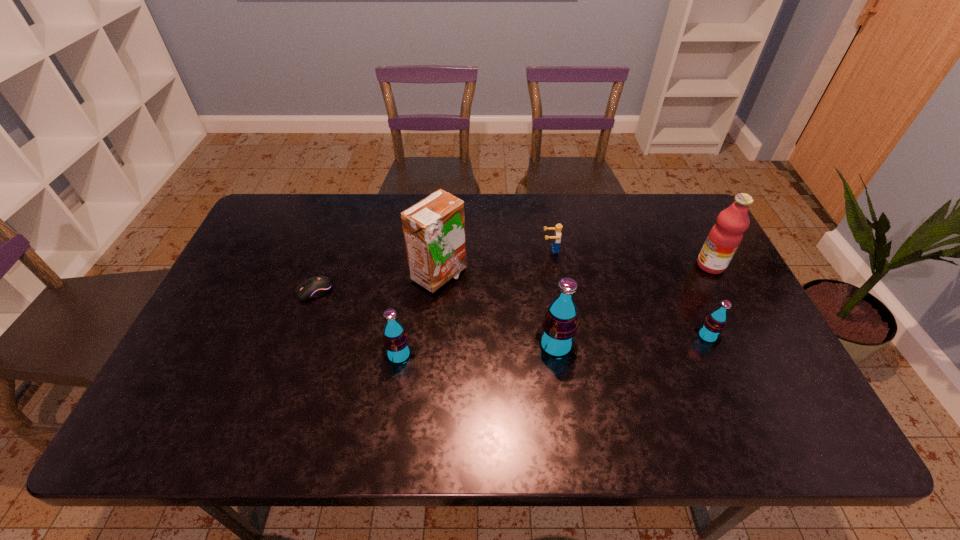
Image resolution: width=960 pixels, height=540 pixels. Identify the location of object identified as the fifth closest to the third shortest object. (396, 347).

Locate an element on the screen. This screenshot has height=540, width=960. soda identified as the second closest to the second shortest soda is located at coordinates (709, 332).

You are a GUI agent. You are given a task and a screenshot of the screen. Output one action in this format:
    pyautogui.click(x=<x>, y=<y>)
    Task: Click on the second closest soda to the carton
    
    Given the screenshot: What is the action you would take?
    pyautogui.click(x=559, y=326)

The height and width of the screenshot is (540, 960). What are the coordinates of `vacant space that satisfies the following two spatial constraints: 1. on the straw side of the carton; 2. on the right side of the second soda from right to left` in the screenshot? It's located at (433, 346).

Where is `free region that satisfies the following two spatial constraints: 1. on the straw side of the fifth tallest object; 2. on the right side of the carton`? This screenshot has width=960, height=540. free region that satisfies the following two spatial constraints: 1. on the straw side of the fifth tallest object; 2. on the right side of the carton is located at coordinates (433, 336).

Where is `vacant space that satisfies the following two spatial constraints: 1. on the straw side of the carton; 2. on the front side of the leftmost soda`? vacant space that satisfies the following two spatial constraints: 1. on the straw side of the carton; 2. on the front side of the leftmost soda is located at coordinates pyautogui.click(x=432, y=355).

The image size is (960, 540). I want to click on vacant space that satisfies the following two spatial constraints: 1. on the face of the second object from right to left; 2. on the right side of the second shortest object, so click(x=564, y=336).